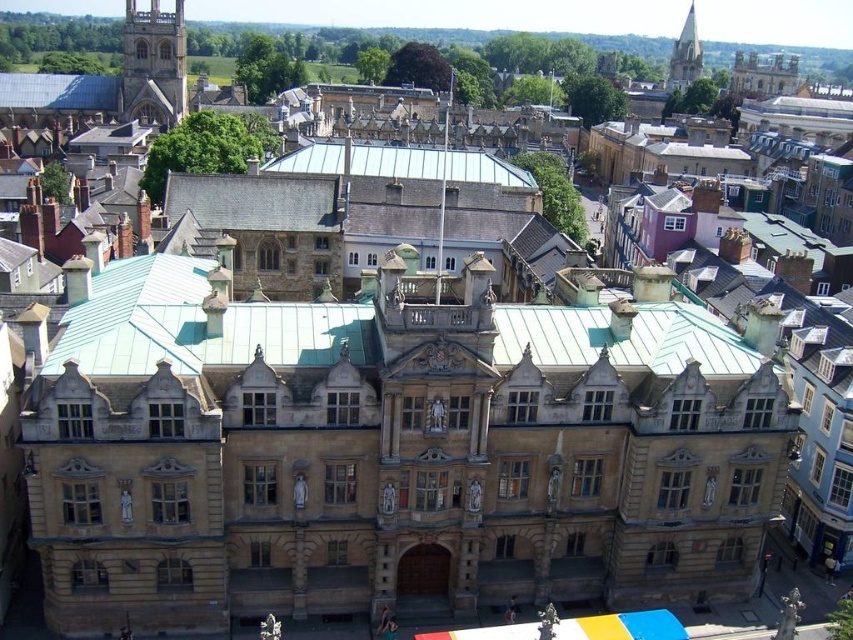
Question: Which of the following is the closest to the observer?

Choices:
 (A) (686, 86)
 (B) (172, 54)

Answer: (B)

Question: Among these objects, which one is nearest to the camera?

Choices:
 (A) green tile roof at center
 (B) smooth stone spire at upper right

Answer: (A)

Question: Estimate the real-world distances between objects in this image. Which object is closer to the green tile roof at center?

Choices:
 (A) stone tower at upper left
 (B) smooth stone spire at upper right

Answer: (A)

Question: Is green tile roof at center smaller than smooth stone spire at upper right?

Choices:
 (A) yes
 (B) no

Answer: (B)

Question: Can you confirm if green tile roof at center is bigger than stone tower at upper left?

Choices:
 (A) no
 (B) yes

Answer: (B)

Question: Does green tile roof at center come behind smooth stone spire at upper right?

Choices:
 (A) no
 (B) yes

Answer: (A)